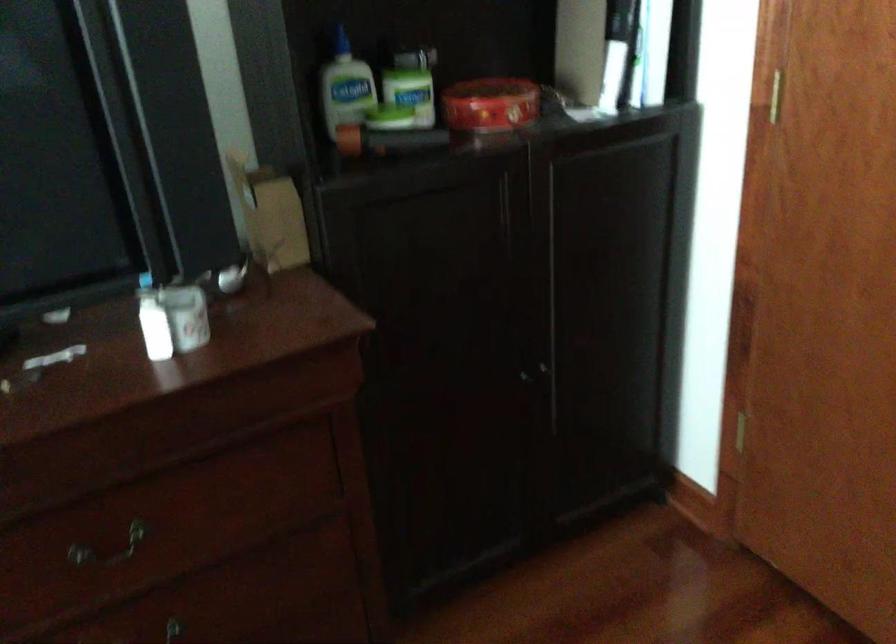
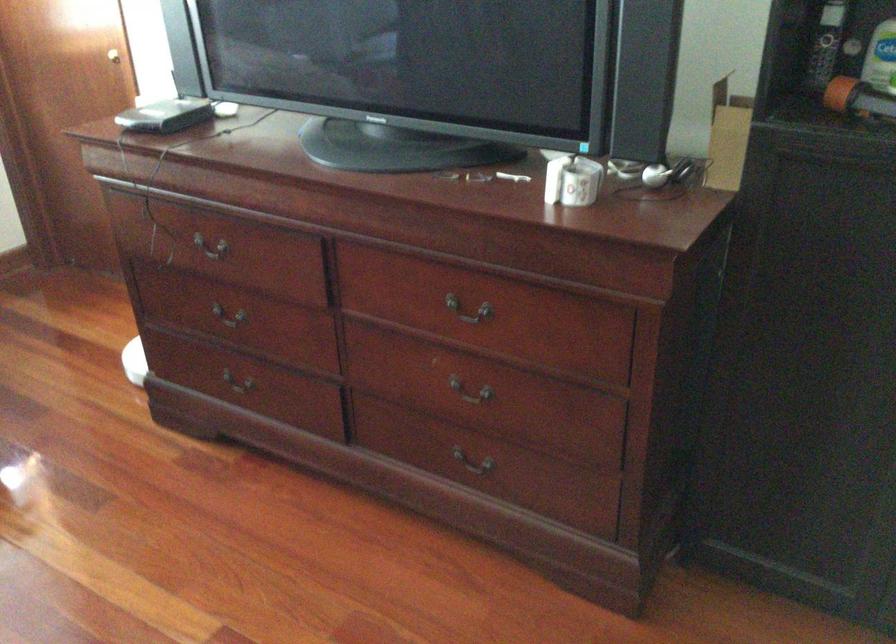
Question: I am providing you with two images of the same scene from different viewpoints. After the viewpoint changes to image2, which objects are now occluded?

Choices:
 (A) green top bottle
 (B) white tape roll
 (C) small black box
 (D) none of these

Answer: (D)